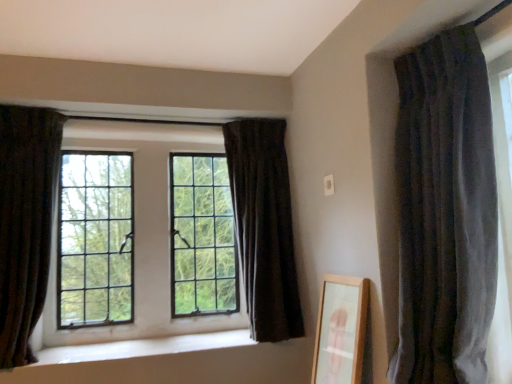
Question: From their relative heights in the image, would you say velvet dark gray curtain at right, acting as the first curtain starting from the front, is taller or shorter than dark velvet curtain at center, the 2th curtain from the left?

Choices:
 (A) short
 (B) tall

Answer: (B)

Question: Considering their positions, is velvet dark gray curtain at right, the first curtain from the right, located in front of or behind dark velvet curtain at center, the 1th curtain in the back-to-front sequence?

Choices:
 (A) behind
 (B) front

Answer: (B)

Question: Estimate the real-world distances between objects in this image. Which object is farther from the clear glass window at center?

Choices:
 (A) dark velvet curtain at center, the 1th curtain in the back-to-front sequence
 (B) wooden framed mirror at lower right
 (C) white smooth window sill at center
 (D) dark velvet curtain at left, arranged as the 3th curtain when viewed from the right
 (E) velvet dark gray curtain at right, acting as the first curtain starting from the front

Answer: (E)

Question: Estimate the real-world distances between objects in this image. Which object is closer to the dark velvet curtain at center, the 1th curtain in the back-to-front sequence?

Choices:
 (A) dark velvet curtain at left, positioned as the second curtain in front-to-back order
 (B) clear glass window at center
 (C) velvet dark gray curtain at right, the first curtain from the right
 (D) wooden framed mirror at lower right
 (E) white smooth window sill at center

Answer: (B)